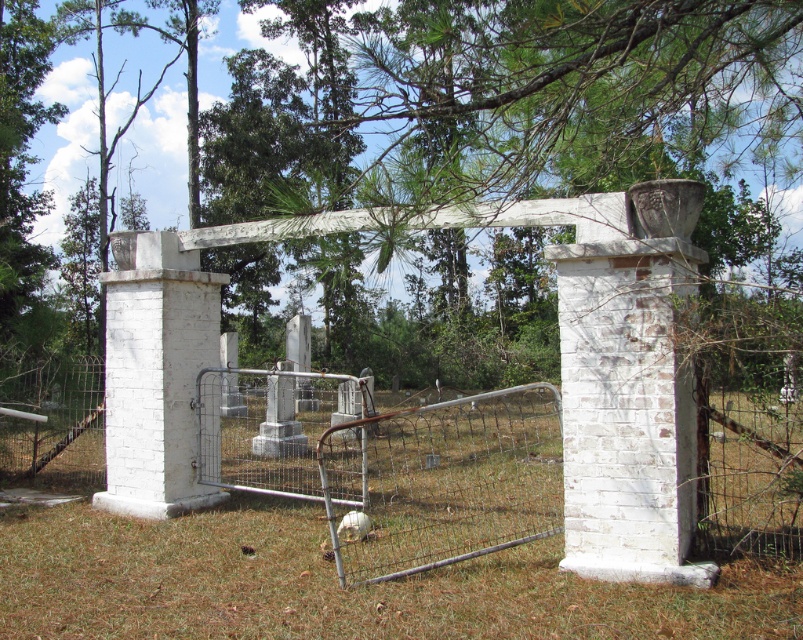
You are a gardener assessing the cemetery gate area. You see the green leafy tree at upper center and the brown dry grass at center. Which object would require more attention for maintenance based on their sizes?

The green leafy tree at upper center requires more attention because it is larger in size than the brown dry grass at center and may need pruning or care to prevent overgrowth.

You are standing at the entrance of the old cemetery gate and notice a point marked at coordinates (520, 113). What object is located at that point?

The point at coordinates (520, 113) corresponds to a green leafy tree at upper center.

You are a maintenance worker tasked with repairing the cemetery gate. You have a 2.5 meter long tool that needs to be placed between the brown dry grass at center and the white painted brick column at center. Will the tool fit in the space between them?

The brown dry grass at center and white painted brick column at center are 2.54 meters apart from each other. Since the tool is 2.5 meters long, it will fit in the space between them as 2.5 meters is slightly shorter than 2.54 meters.